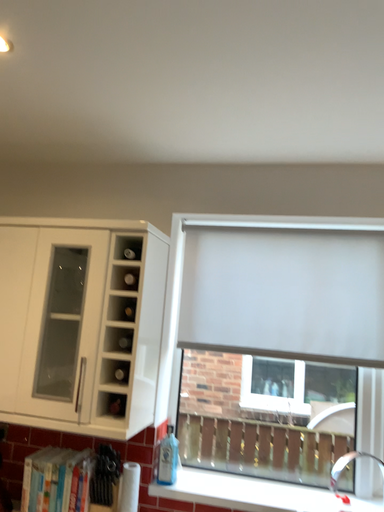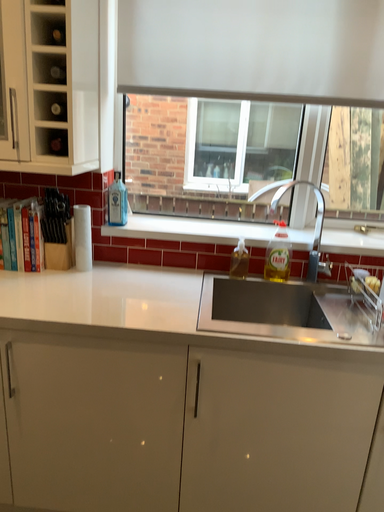
Question: How did the camera likely rotate when shooting the video?

Choices:
 (A) rotated right
 (B) rotated left

Answer: (A)